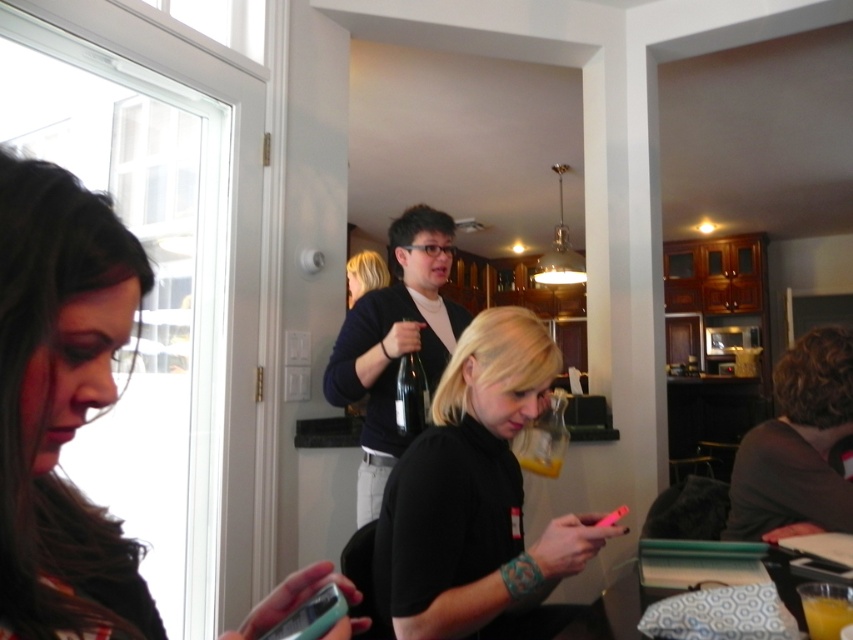
You are standing in the room and want to move from point A to point B. Point A is at coordinates point (x=444, y=317) and point B is at coordinates point (x=402, y=321). Which point is closer to you?

Point B at coordinates point (x=402, y=321) is closer to you because it is nearer to the camera than point A at coordinates point (x=444, y=317).

Based on the photo, you are standing at point (415, 474) in the room. You want to take a photo of the camera in the scene. Can you reach the camera from your current position without moving?

The distance between point (415, 474) and the camera is 1.23 meters. Since you are not moving from your current position, you cannot physically reach the camera which is 1.23 meters away.